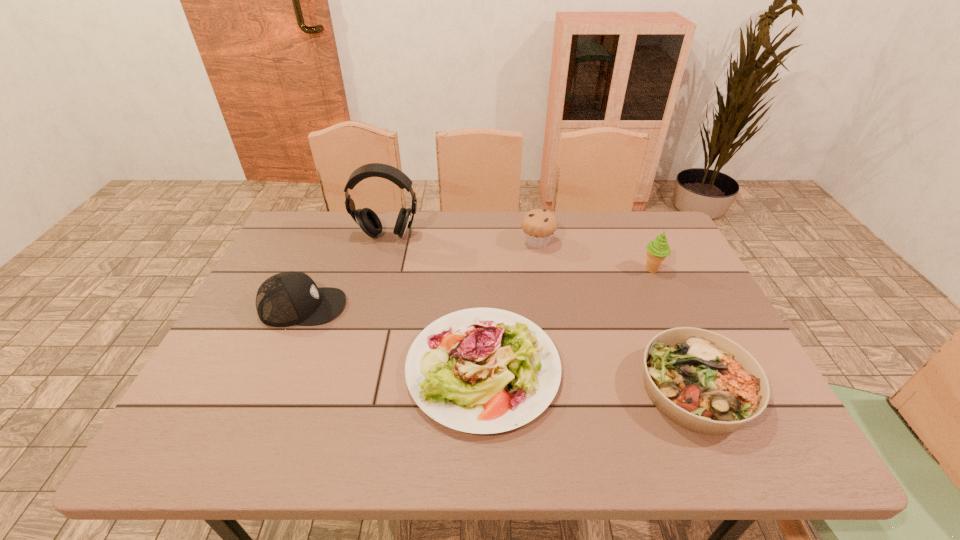
This screenshot has width=960, height=540. What are the coordinates of `free space located 0.160m on the front-facing side of the cap` in the screenshot? It's located at (408, 307).

This screenshot has width=960, height=540. I want to click on vacant space located on the back of the left salad plate, so click(x=482, y=255).

Find the location of a particular element. The width and height of the screenshot is (960, 540). vacant space located on the back of the right salad plate is located at coordinates (665, 321).

You are a GUI agent. You are given a task and a screenshot of the screen. Output one action in this format:
    pyautogui.click(x=<x>, y=<y>)
    Task: Click on the earphone situated at the far edge
    
    Given the screenshot: What is the action you would take?
    pyautogui.click(x=367, y=219)

At what (x,y) coordinates should I click in order to perform the action: click on muffin that is at the far edge. Please return your answer as a coordinate pair (x, y). Looking at the image, I should click on (538, 225).

You are a GUI agent. You are given a task and a screenshot of the screen. Output one action in this format:
    pyautogui.click(x=<x>, y=<y>)
    Task: Click on the object present at the left edge
    
    Given the screenshot: What is the action you would take?
    pyautogui.click(x=285, y=299)

The height and width of the screenshot is (540, 960). Identify the location of icecream that is at the right edge. (657, 250).

You are a GUI agent. You are given a task and a screenshot of the screen. Output one action in this format:
    pyautogui.click(x=<x>, y=<y>)
    Task: Click on the salad plate that is at the right edge
    The image size is (960, 540).
    Given the screenshot: What is the action you would take?
    pyautogui.click(x=704, y=382)

Find the location of `object present at the near right corner`. object present at the near right corner is located at coordinates (704, 382).

Find the location of a particular element. Image resolution: width=960 pixels, height=540 pixels. free space at the far edge of the desktop is located at coordinates [x=598, y=219].